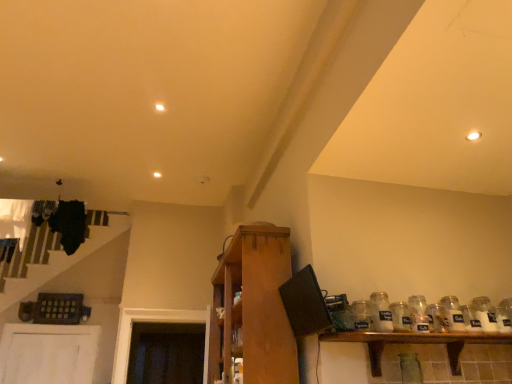
Locate an element on the screen. The height and width of the screenshot is (384, 512). free spot to the right of clear glass jar at shelf right, which is the 4th glass jar in right-to-left order is located at coordinates [383, 333].